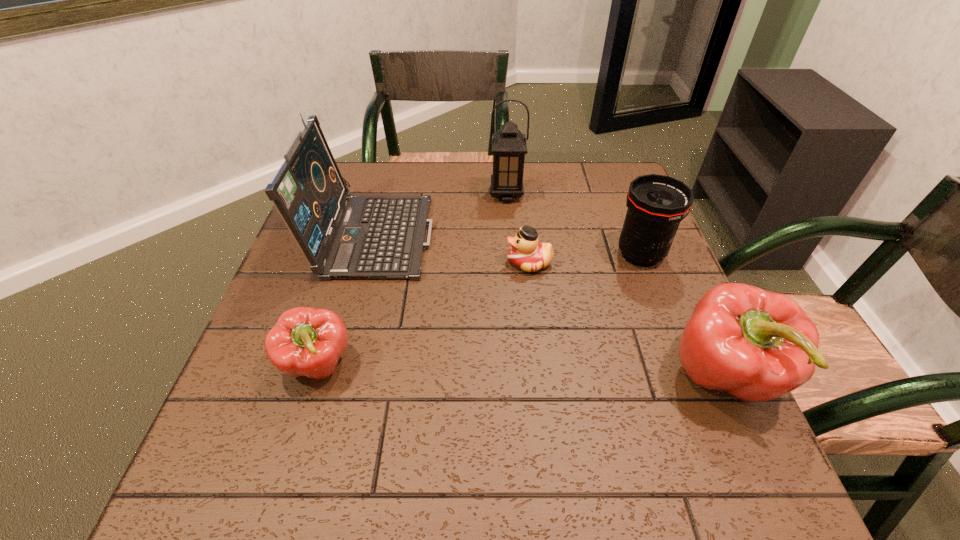
I want to click on telephoto lens that is at the right edge, so click(x=657, y=204).

Image resolution: width=960 pixels, height=540 pixels. In order to click on object at the far left corner in this screenshot , I will do 362,237.

The height and width of the screenshot is (540, 960). Identify the location of object that is at the near left corner. (305, 341).

Locate an element on the screen. This screenshot has height=540, width=960. object that is at the near right corner is located at coordinates (757, 345).

At what (x,y) coordinates should I click in order to perform the action: click on free space at the far edge. Please return your answer as a coordinate pair (x, y). Looking at the image, I should click on point(444,192).

Locate an element on the screen. This screenshot has width=960, height=540. free space at the near edge of the desktop is located at coordinates (578, 435).

Identify the location of vacant space at the left edge of the desktop. This screenshot has width=960, height=540. (300, 273).

Image resolution: width=960 pixels, height=540 pixels. Identify the location of vacant space at the far left corner of the desktop. (365, 194).

Locate an element on the screen. blank space at the far right corner is located at coordinates (601, 165).

Where is `vacant point located between the shortest object and the telephoto lens`? The height and width of the screenshot is (540, 960). vacant point located between the shortest object and the telephoto lens is located at coordinates (585, 258).